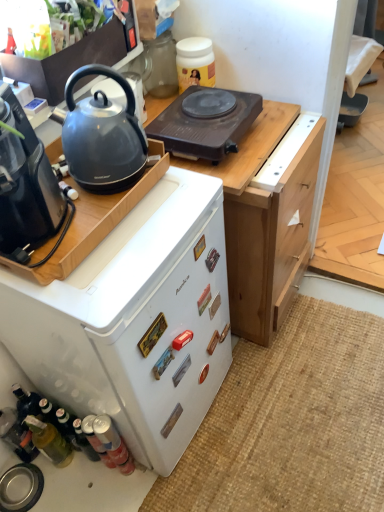
Image resolution: width=384 pixels, height=512 pixels. I want to click on free spot above white matte refrigerator at center-left (from a real-world perspective), so click(x=110, y=225).